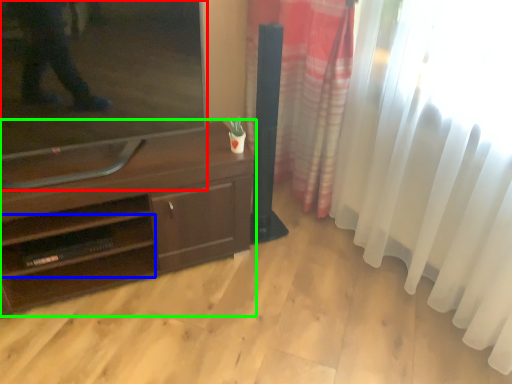
Question: Which object is positioned farthest from television (highlighted by a red box)? Select from shelf (highlighted by a blue box) and desk (highlighted by a green box).

Choices:
 (A) shelf
 (B) desk

Answer: (A)